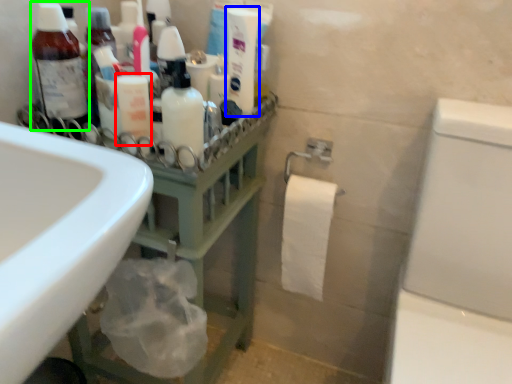
Question: Which object is the farthest from toiletry (highlighted by a red box)? Choose among these: cleaning product (highlighted by a blue box) or bottle (highlighted by a green box).

Choices:
 (A) cleaning product
 (B) bottle

Answer: (A)